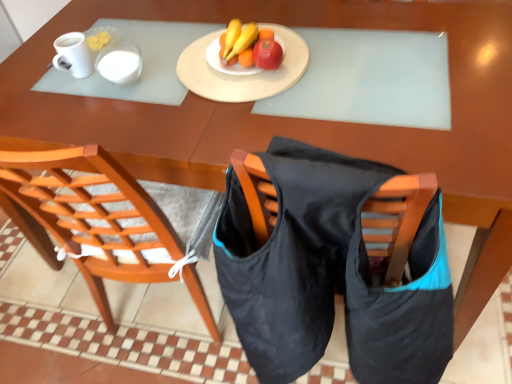
Where is `vacant area in front of white glossy mug at upper left`? vacant area in front of white glossy mug at upper left is located at coordinates (70, 106).